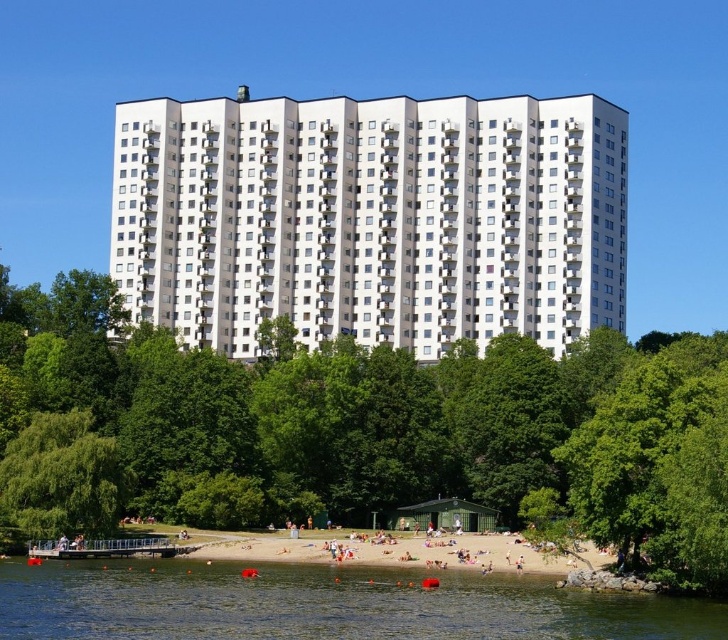
Question: Which of the following is the closest to the observer?

Choices:
 (A) green leafy tree at center
 (B) metallic silver boat at lower center
 (C) clear water at lower center

Answer: (C)

Question: Estimate the real-world distances between objects in this image. Which object is closer to the clear water at lower center?

Choices:
 (A) green leafy tree at lower left
 (B) green leafy tree at center
 (C) white smooth building at center
 (D) metallic silver boat at lower center

Answer: (A)

Question: Can you confirm if clear water at lower center is wider than metallic silver boat at lower center?

Choices:
 (A) no
 (B) yes

Answer: (B)

Question: Is green leafy tree at lower left bigger than metallic silver boat at lower center?

Choices:
 (A) yes
 (B) no

Answer: (A)

Question: Estimate the real-world distances between objects in this image. Which object is farther from the clear water at lower center?

Choices:
 (A) white smooth building at center
 (B) metallic silver boat at lower center

Answer: (A)

Question: Is green leafy tree at center smaller than green leafy tree at lower left?

Choices:
 (A) yes
 (B) no

Answer: (B)